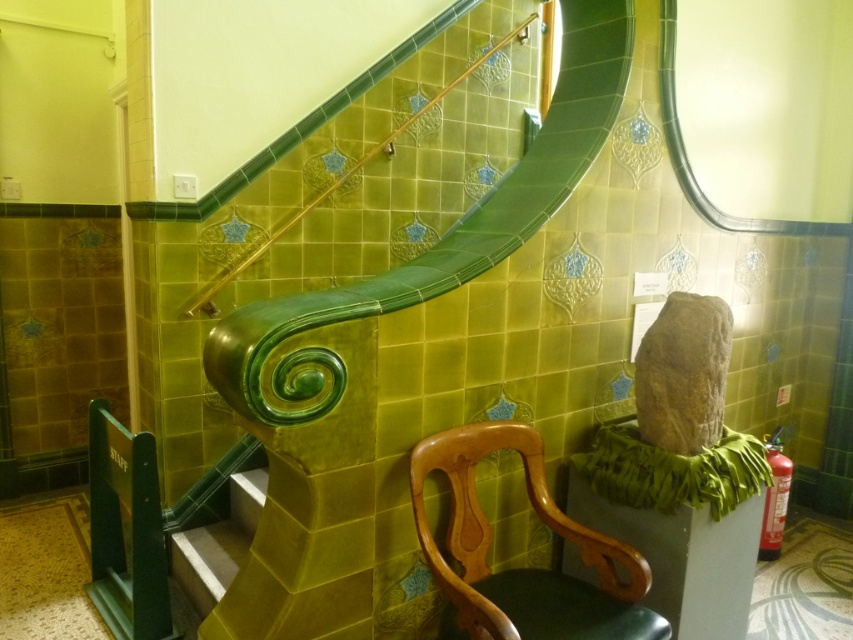
Question: Does wooden chair at center have a smaller size compared to green glossy stair at lower center?

Choices:
 (A) yes
 (B) no

Answer: (B)

Question: Can you confirm if wooden chair at center is bigger than green glossy stair at lower center?

Choices:
 (A) no
 (B) yes

Answer: (B)

Question: Does wooden chair at center appear on the left side of green glossy stair at lower center?

Choices:
 (A) no
 (B) yes

Answer: (A)

Question: Which object appears closest to the camera in this image?

Choices:
 (A) green glossy stair at lower center
 (B) wooden chair at center

Answer: (B)